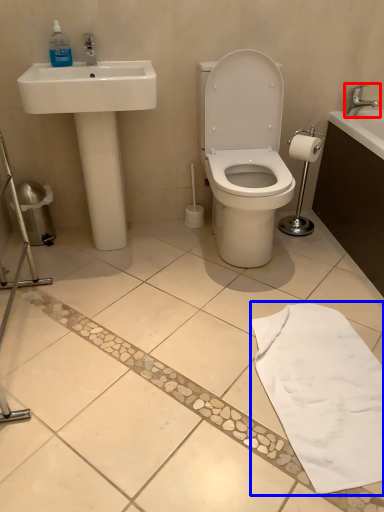
Question: Which object appears closest to the camera in this image, tap (highlighted by a red box) or bath towel (highlighted by a blue box)?

Choices:
 (A) tap
 (B) bath towel

Answer: (B)